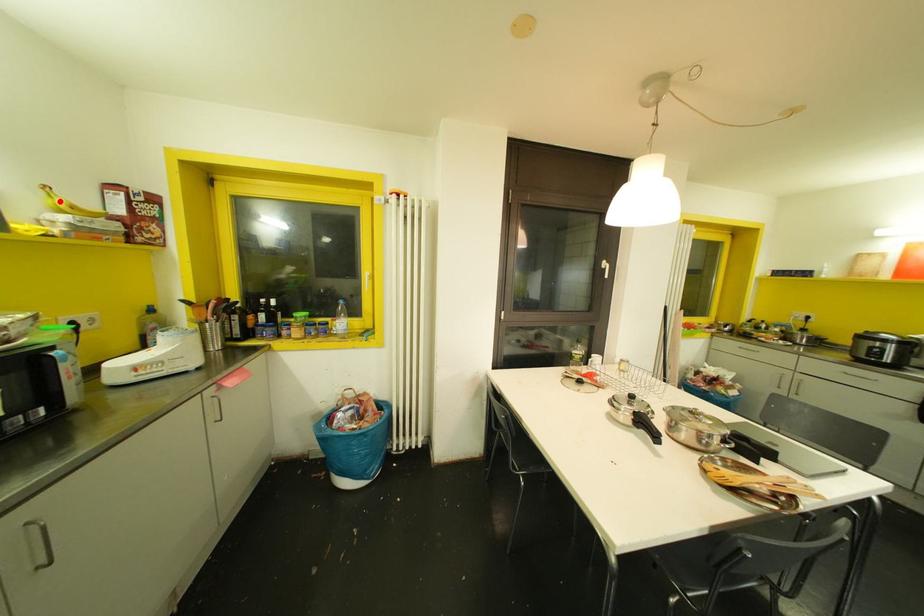
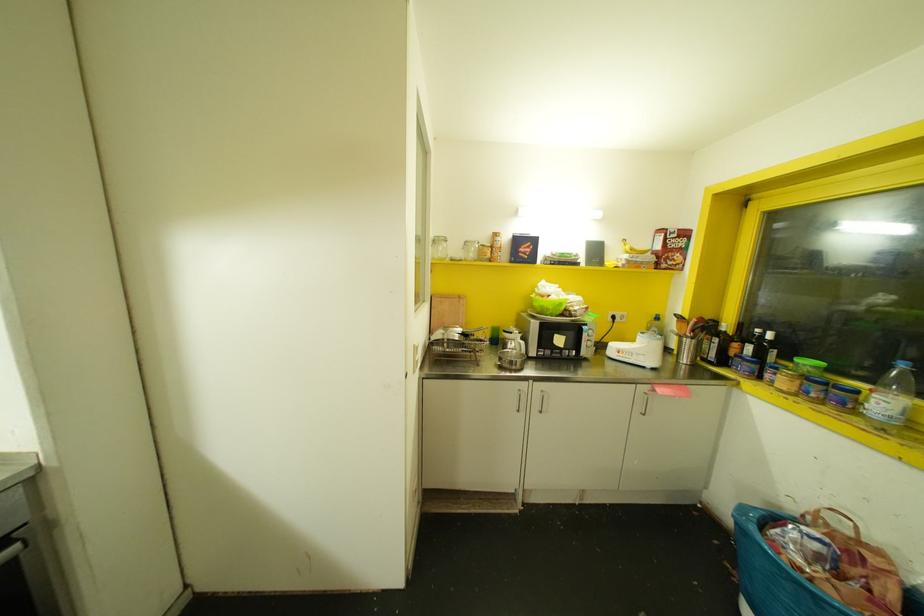
Question: I am providing you with two images of the same scene from different viewpoints. A red point is shown in image1. For the corresponding object point in image2, is it positioned nearer or farther from the camera?

Choices:
 (A) Nearer
 (B) Farther

Answer: (A)